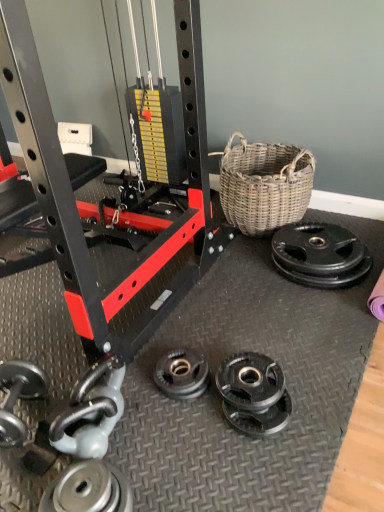
The width and height of the screenshot is (384, 512). Find the location of `unoccupied region to the right of silver metallic dumbbell at lower left`. unoccupied region to the right of silver metallic dumbbell at lower left is located at coordinates (162, 432).